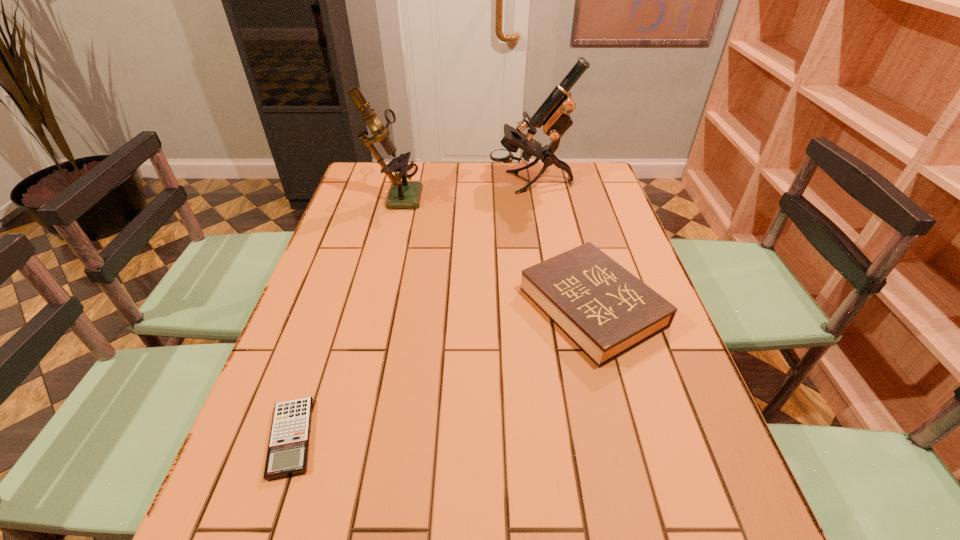
Find the location of `free spot between the right microscope and the shortest object`. free spot between the right microscope and the shortest object is located at coordinates (411, 310).

Identify the location of empty space between the right microscope and the hardback book. Image resolution: width=960 pixels, height=540 pixels. (561, 245).

Locate which object ranks in proximity to the left microscope. Please provide its 2D coordinates. Your answer should be formatted as a tuple, i.e. [(x, y)], where the tuple contains the x and y coordinates of a point satisfying the conditions above.

[(553, 115)]

Find the location of `object that can be found as the closest to the right microscope`. object that can be found as the closest to the right microscope is located at coordinates (403, 194).

At what (x,y) coordinates should I click in order to perform the action: click on free space that satisfies the following two spatial constraints: 1. through the eyepiece of the right microscope; 2. on the right side of the hardback book. Please return your answer as a coordinate pair (x, y). This screenshot has height=540, width=960. Looking at the image, I should click on (552, 307).

This screenshot has width=960, height=540. Identify the location of free point that satisfies the following two spatial constraints: 1. at the eyepiece of the left microscope; 2. on the right side of the second shortest object. (364, 307).

You are a GUI agent. You are given a task and a screenshot of the screen. Output one action in this format:
    pyautogui.click(x=<x>, y=<y>)
    Task: Click on the blank space that satisfies the following two spatial constraints: 1. on the back side of the second shortest object; 2. at the eyepiece of the left microscope
    The image size is (960, 540).
    Given the screenshot: What is the action you would take?
    pyautogui.click(x=563, y=195)

Identify the location of blank area in the image that satisfies the following two spatial constraints: 1. at the eyepiece of the left microscope; 2. on the right side of the second nearest object. This screenshot has height=540, width=960. (364, 307).

At what (x,y) coordinates should I click in order to perform the action: click on vacant space that satisfies the following two spatial constraints: 1. at the eyepiece of the left microscope; 2. on the back side of the third tallest object. Please return your answer as a coordinate pair (x, y). Looking at the image, I should click on (364, 307).

I want to click on vacant area in the image that satisfies the following two spatial constraints: 1. on the back side of the second nearest object; 2. through the eyepiece of the right microscope, so click(x=559, y=183).